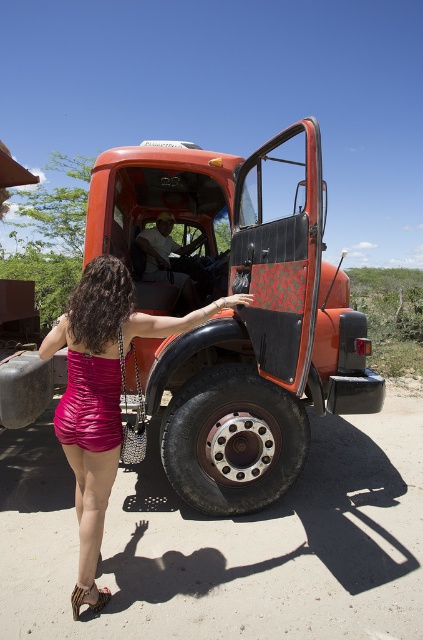
You are taking a photo of the truck and want to focus on the point at coordinates point (244, 417) and point (79, 588). Which point should you focus on first to ensure both are in focus?

You should focus on point (244, 417) first because it is closer to the camera than point (79, 588). This ensures that both points will be in focus when using the camera.

You are a photographer aiming to capture the metallic red truck at center without including the leather textured sandal at lower left in the shot. Based on their positions, is this possible?

The metallic red truck at center is positioned over the leather textured sandal at lower left, so the truck is directly in front of the sandal. This means the truck would block the sandal from view, making it possible to capture the truck without the sandal appearing in the photo.

You are a photographer trying to capture a closeup of the black rubber tire at lower center and the leather textured sandal at lower left. Since you want both objects to appear similarly sized in the photo, which object should you move closer to the camera?

The leather textured sandal at lower left should be moved closer to the camera because the black rubber tire at lower center is larger in size, so bringing the smaller sandal closer will balance their apparent sizes in the photo.